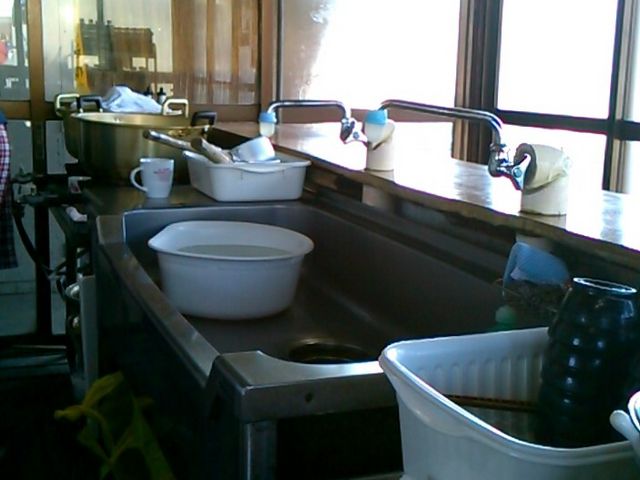
This screenshot has height=480, width=640. I want to click on window, so click(561, 51).